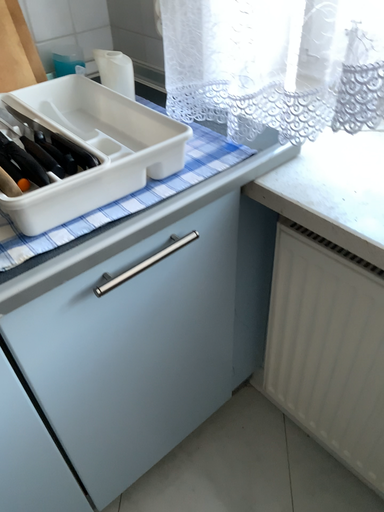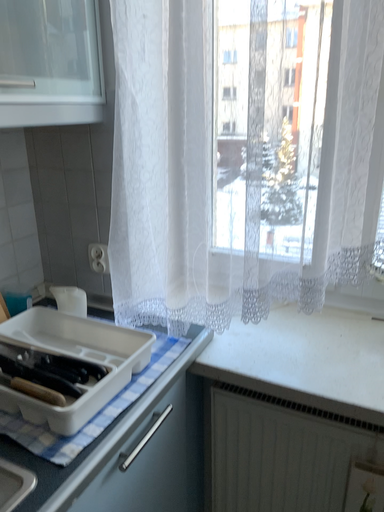
Question: How did the camera likely rotate when shooting the video?

Choices:
 (A) rotated downward
 (B) rotated upward

Answer: (B)